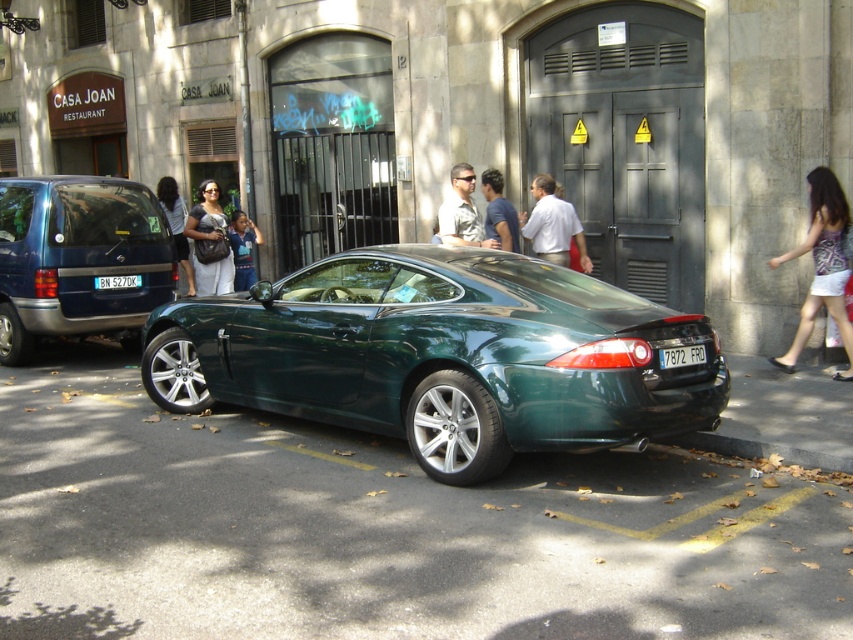
You are a photographer carrying a matte black camera at center and wearing a matte khaki shirt at center. You want to take a photo of the dark green Jaguar XK parked nearby. Since you need to maintain a safe distance from the vehicle, can you estimate if the space between you and the camera is sufficient to avoid capturing your body in the frame?

The matte khaki shirt at center and matte black camera at center are 3.75 meters apart from each other. Since the camera is 3.75 meters away from your shirt, which is part of your body, this distance should be sufficient to avoid capturing your body in the photo, assuming typical camera angles and focal lengths.

You are a photographer holding a matte black camera at center and wearing a matte khaki shirt at center. You need to determine if your shirt will cover the camera when you fold your arms. Can you confirm based on their sizes?

The matte khaki shirt at center has a larger width than the matte black camera at center, so yes, the shirt can cover the camera when you fold your arms.